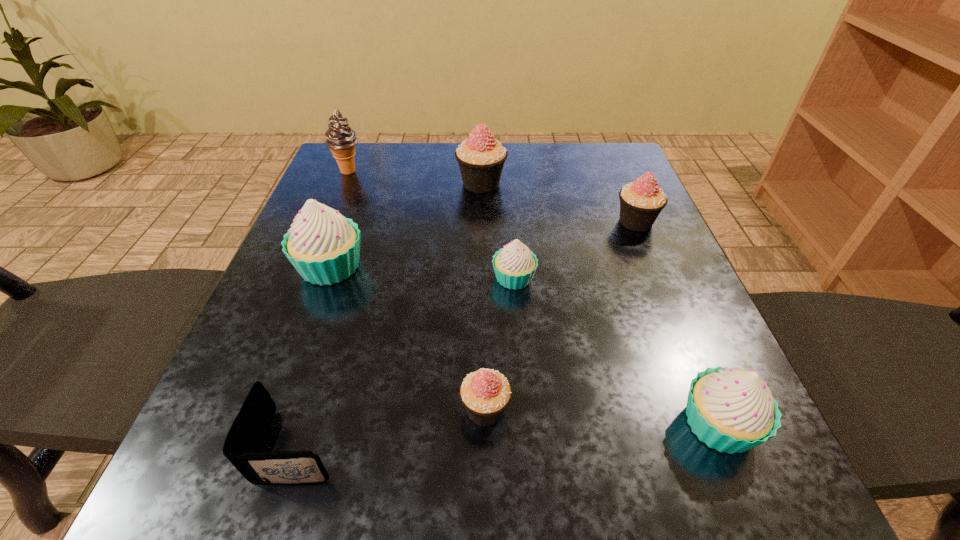
Locate an element on the screen. vacant space at the far edge of the desktop is located at coordinates (443, 182).

The width and height of the screenshot is (960, 540). What are the coordinates of `vacant area at the left edge of the desktop` in the screenshot? It's located at (306, 448).

What are the coordinates of `vacant position at the right edge of the desktop` in the screenshot? It's located at (600, 256).

The width and height of the screenshot is (960, 540). Identify the location of vacant region at the near left corner. (201, 481).

The height and width of the screenshot is (540, 960). Identify the location of vacant space at the far right corner of the desktop. (581, 173).

Where is `unoccupied area between the leftmost white cupcake and the wallet`? This screenshot has width=960, height=540. unoccupied area between the leftmost white cupcake and the wallet is located at coordinates (315, 356).

Locate an element on the screen. The image size is (960, 540). free space between the rightmost pink cupcake and the second biggest white cupcake is located at coordinates (677, 323).

The height and width of the screenshot is (540, 960). Identify the location of unoccupied position between the icecream and the second biggest pink cupcake. (492, 197).

The width and height of the screenshot is (960, 540). Find the location of `free point between the biggest pink cupcake and the fifth nearest cupcake`. free point between the biggest pink cupcake and the fifth nearest cupcake is located at coordinates (559, 202).

The height and width of the screenshot is (540, 960). What are the coordinates of `free space between the wallet and the farthest pink cupcake` in the screenshot? It's located at (390, 314).